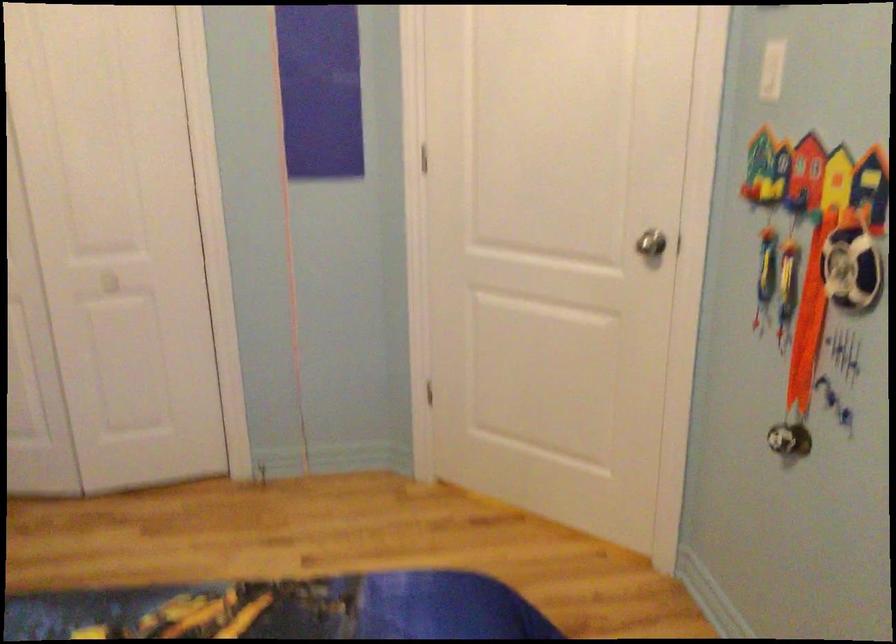
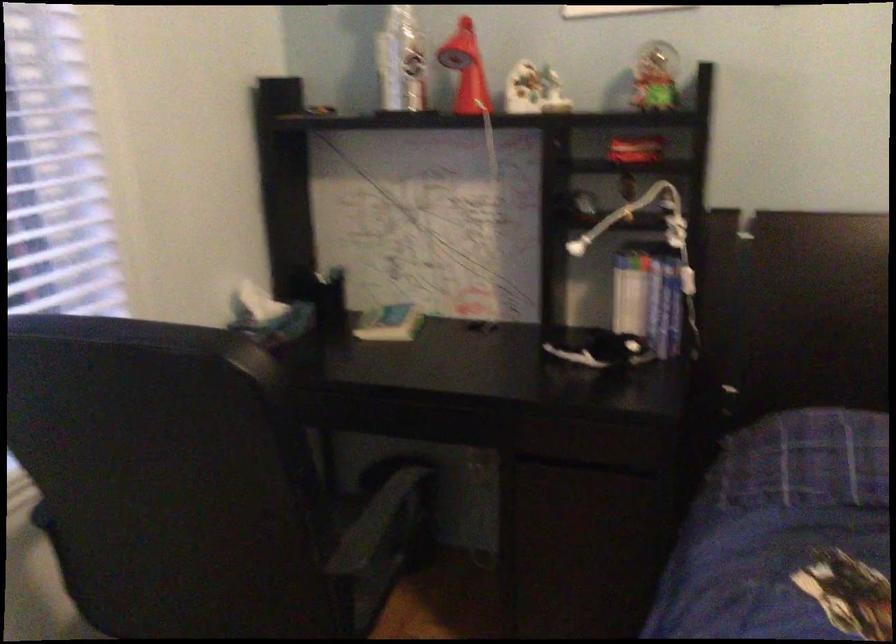
How did the camera likely rotate?

The camera's rotation is toward left-down.